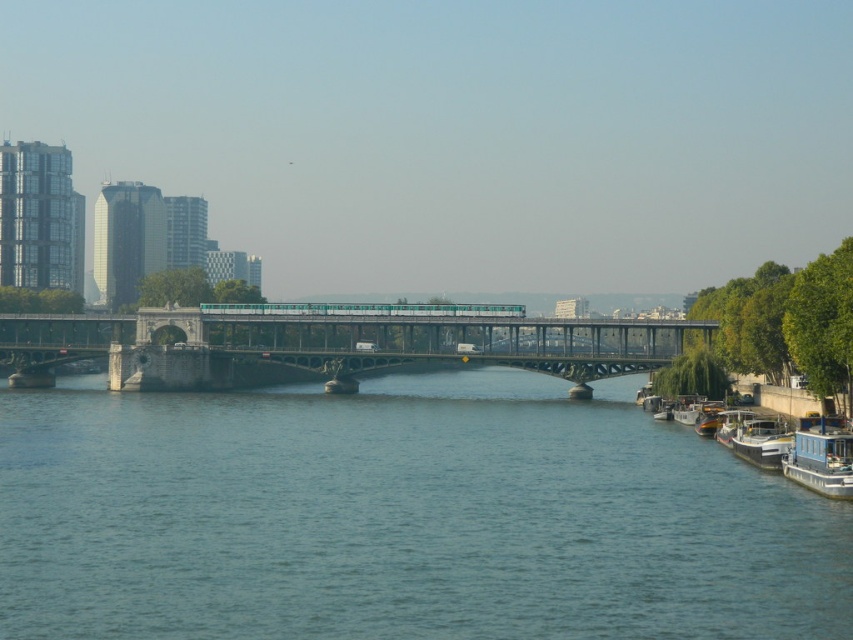
Who is lower down, green metallic bridge at center or white glossy boat at lower right?

white glossy boat at lower right is lower down.

Is green metallic bridge at center shorter than white glossy boat at lower right?

No, green metallic bridge at center is not shorter than white glossy boat at lower right.

Is point (119, 371) positioned after point (769, 420)?

That is True.

Where is `green metallic bridge at center`? green metallic bridge at center is located at coordinates click(351, 339).

Is white glossy boat at lower right behind white wooden boat at right?

No.

Who is more distant from viewer, (758, 458) or (724, 440)?

Positioned behind is point (724, 440).

Which is in front, point (756, 456) or point (740, 419)?

Positioned in front is point (756, 456).

This screenshot has width=853, height=640. I want to click on white glossy boat at lower right, so (761, 442).

Between point (767, 456) and point (704, 422), which one is positioned in front?

Point (767, 456) is more forward.

Between point (740, 442) and point (701, 435), which one is positioned behind?

The point (701, 435) is behind.

At what (x,y) coordinates should I click in order to perform the action: click on white glossy boat at lower right. Please return your answer as a coordinate pair (x, y). Looking at the image, I should click on (761, 442).